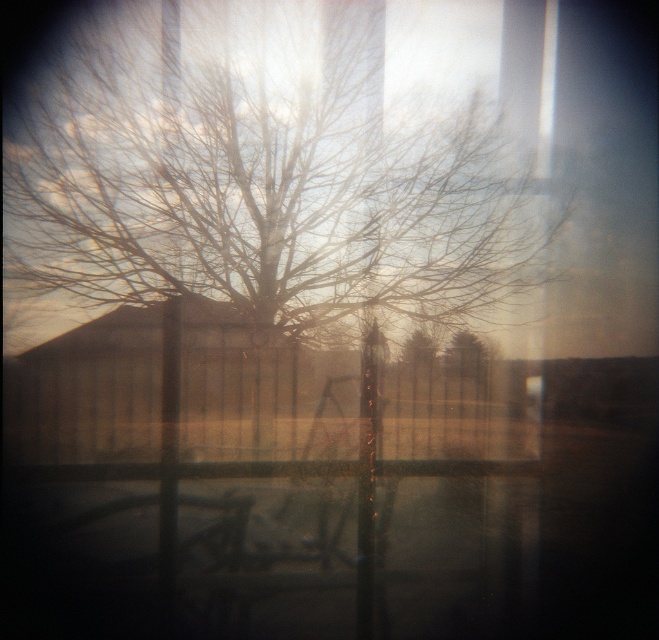
Question: Which point is farther to the camera?

Choices:
 (A) (449, 369)
 (B) (181, 316)
 (C) (426, 340)

Answer: (C)

Question: Which point is closer to the camera?

Choices:
 (A) (407, 339)
 (B) (295, 452)

Answer: (B)

Question: Which object is closer to the camera taking this photo?

Choices:
 (A) brown wooden fence at center
 (B) green matte tree at center
 (C) bare branches at center

Answer: (A)

Question: Is brown wooden fence at center further to the viewer compared to bare branches at center?

Choices:
 (A) no
 (B) yes

Answer: (A)

Question: Is brown wooden fence at center smaller than green matte tree at center?

Choices:
 (A) no
 (B) yes

Answer: (A)

Question: Is brown wooden fence at center further to the viewer compared to bare branches at center?

Choices:
 (A) yes
 (B) no

Answer: (B)